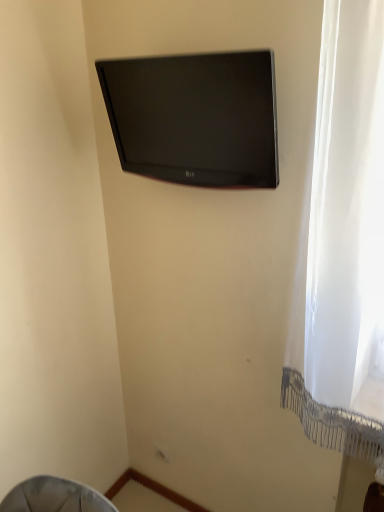
Locate an element on the screen. The width and height of the screenshot is (384, 512). black glossy tv at upper center is located at coordinates (195, 117).

Measure the distance between point (250, 54) and camera.

The distance of point (250, 54) from camera is 36.30 inches.

Describe the element at coordinates (195, 117) in the screenshot. This screenshot has width=384, height=512. I see `black glossy tv at upper center` at that location.

You are a GUI agent. You are given a task and a screenshot of the screen. Output one action in this format:
    pyautogui.click(x=<x>, y=<y>)
    Task: Click on the black glossy tv at upper center
    This screenshot has width=384, height=512.
    Given the screenshot: What is the action you would take?
    pyautogui.click(x=195, y=117)